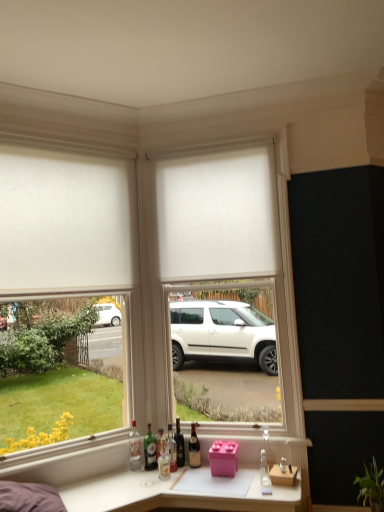
Locate an element on the screen. This screenshot has height=512, width=384. vacant area situated to the left side of clear glass bottle at lower left, positioned as the seventh bottle in right-to-left order is located at coordinates (115, 472).